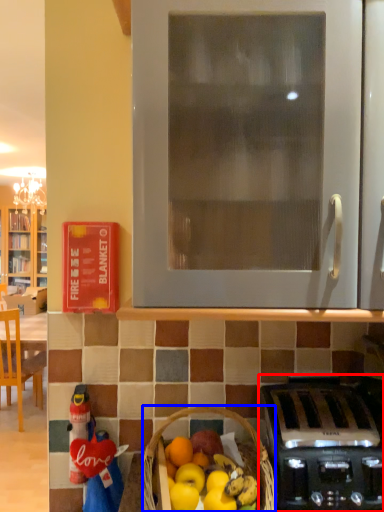
Question: Which object is further to the camera taking this photo, kitchen appliance (highlighted by a red box) or picnic basket (highlighted by a blue box)?

Choices:
 (A) kitchen appliance
 (B) picnic basket

Answer: (A)